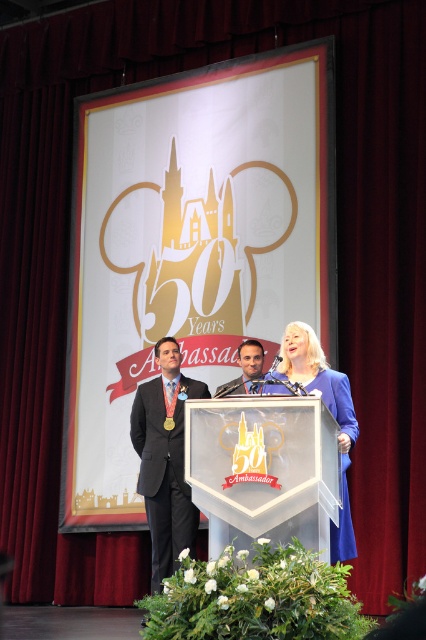
Question: Which object is positioned farthest from the dark blue fabric business suit at center?

Choices:
 (A) matte gold medal at center
 (B) blue satin dress at center

Answer: (B)

Question: Does matte black suit at left have a smaller size compared to dark blue fabric business suit at center?

Choices:
 (A) yes
 (B) no

Answer: (B)

Question: Among these points, which one is nearest to the camera?

Choices:
 (A) (239, 364)
 (B) (221, 388)
 (C) (307, 376)

Answer: (C)

Question: Does blue satin dress at center appear over dark blue fabric business suit at center?

Choices:
 (A) no
 (B) yes

Answer: (A)

Question: Which of these objects is positioned farthest from the matte black suit at left?

Choices:
 (A) dark blue fabric business suit at center
 (B) blue satin dress at center

Answer: (B)

Question: Does matte black suit at left appear on the right side of matte gold medal at center?

Choices:
 (A) yes
 (B) no

Answer: (B)